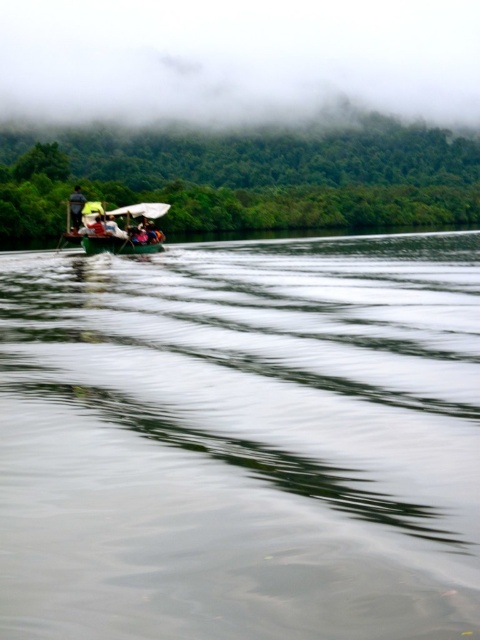
Can you confirm if green plastic canoe at center is bigger than green fabric boat at center?

Indeed, green plastic canoe at center has a larger size compared to green fabric boat at center.

Can you confirm if green plastic canoe at center is positioned to the right of green fabric boat at center?

Correct, you'll find green plastic canoe at center to the right of green fabric boat at center.

Which is in front, point (126, 243) or point (105, 232)?

Positioned in front is point (105, 232).

Locate an element on the screen. green plastic canoe at center is located at coordinates (119, 244).

Between green rubber boat at upper left and green plastic canoe at center, which one has less height?

green plastic canoe at center

Is green rubber boat at upper left positioned before green plastic canoe at center?

Yes, green rubber boat at upper left is closer to the viewer.

Image resolution: width=480 pixels, height=640 pixels. Find the location of `green rubber boat at upper left`. green rubber boat at upper left is located at coordinates (241, 440).

Who is lower down, green plastic boat at center or green plastic canoe at center?

green plastic canoe at center

Is green plastic boat at center in front of green plastic canoe at center?

No, green plastic boat at center is further to the viewer.

Between point (99, 220) and point (109, 244), which one is positioned behind?

The point (99, 220) is more distant.

This screenshot has width=480, height=640. I want to click on green plastic boat at center, so click(120, 228).